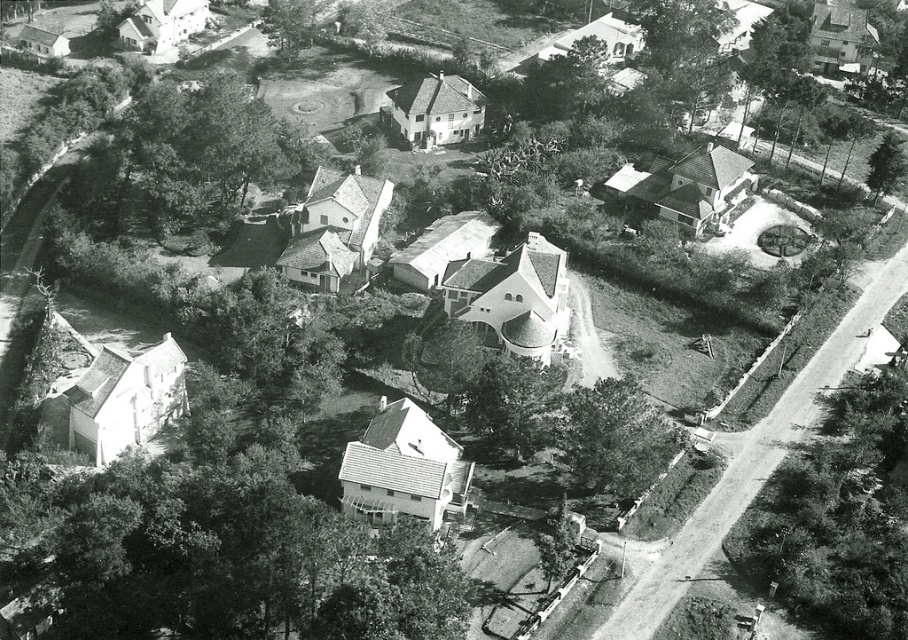
Question: Where is green leafy tree at center located in relation to green textured tree at right in the image?

Choices:
 (A) right
 (B) left

Answer: (B)

Question: Which object is farther from the camera taking this photo?

Choices:
 (A) dark green leafy tree at upper left
 (B) smooth bark tree at upper right
 (C) smooth bark tree at right

Answer: (B)

Question: Can you confirm if smooth bark tree at right is positioned to the right of green leafy tree at center?

Choices:
 (A) no
 (B) yes

Answer: (B)

Question: Does dark green leafy tree at upper left appear on the right side of green leafy tree at center?

Choices:
 (A) no
 (B) yes

Answer: (A)

Question: Which of the following is the farthest from the observer?

Choices:
 (A) (905, 618)
 (B) (649, 445)

Answer: (B)

Question: Which point appears farthest from the camera in this image?

Choices:
 (A) (297, 51)
 (B) (520, 364)
 (C) (206, 200)

Answer: (A)